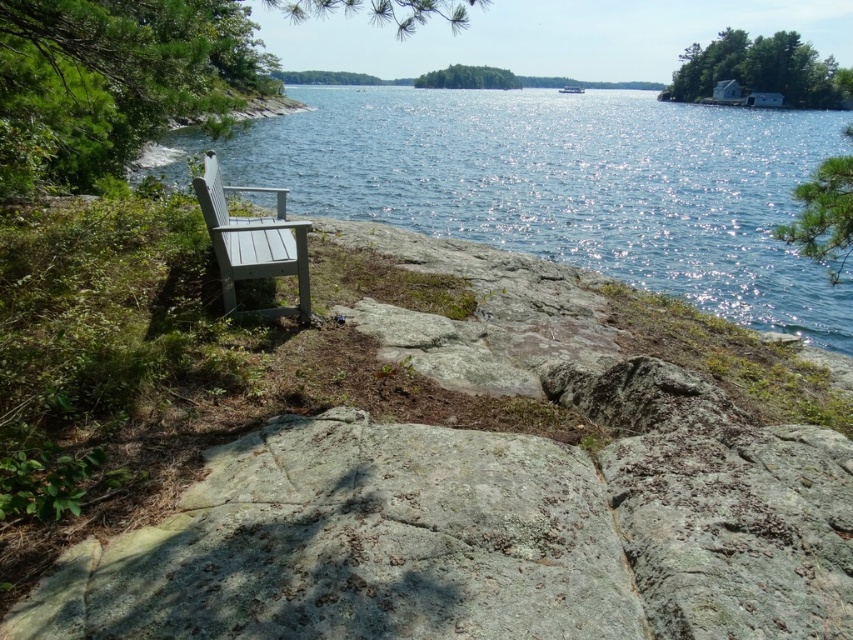
Is point (787, 214) positioned behind point (218, 163)?

Yes, point (787, 214) is farther from viewer.

The height and width of the screenshot is (640, 853). What do you see at coordinates (563, 184) in the screenshot?
I see `glistening blue water at center` at bounding box center [563, 184].

Which is in front, point (634, 106) or point (252, 268)?

Point (252, 268) is more forward.

Where is `glistening blue water at center`? This screenshot has width=853, height=640. glistening blue water at center is located at coordinates (563, 184).